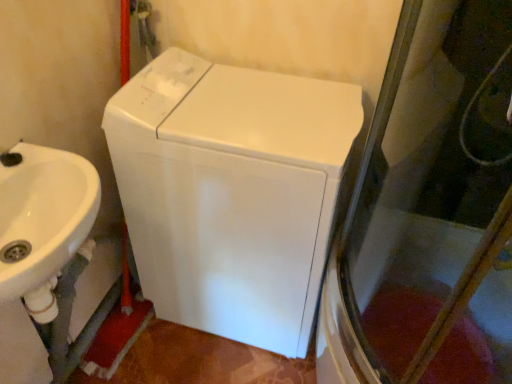
You are a GUI agent. You are given a task and a screenshot of the screen. Output one action in this format:
    pyautogui.click(x=<x>, y=<y>)
    Task: Click on the white glossy washing machine at center
    This screenshot has height=384, width=512.
    Given the screenshot: What is the action you would take?
    pyautogui.click(x=231, y=192)

What do you see at coordinates (231, 192) in the screenshot? The image size is (512, 384). I see `white glossy washing machine at center` at bounding box center [231, 192].

In order to face white glossy washing machine at center, should I rotate leftwards or rightwards?

A 1.339 degree turn to the left will do.

Measure the distance between white glossy washing machine at center and camera.

The distance of white glossy washing machine at center from camera is 37.16 inches.

Locate an element on the screen. white glossy sink at left is located at coordinates (42, 225).

Describe the element at coordinates (42, 225) in the screenshot. I see `white glossy sink at left` at that location.

Locate an element on the screen. This screenshot has height=384, width=512. white glossy washing machine at center is located at coordinates (231, 192).

Which is more to the left, white glossy washing machine at center or white glossy sink at left?

white glossy sink at left is more to the left.

Is white glossy washing machine at center positioned before white glossy sink at left?

That is False.

Considering the positions of points (176, 95) and (17, 188), is point (176, 95) closer to camera compared to point (17, 188)?

No, (176, 95) is further to viewer.

From the image's perspective, is white glossy washing machine at center below white glossy sink at left?

No.

From a real-world perspective, between white glossy washing machine at center and white glossy sink at left, who is vertically higher?

In real-world perspective, white glossy sink at left is above.

Is white glossy washing machine at center thinner than white glossy sink at left?

No, white glossy washing machine at center is not thinner than white glossy sink at left.

Which of these two, white glossy washing machine at center or white glossy sink at left, stands shorter?

white glossy sink at left.

Does white glossy washing machine at center have a larger size compared to white glossy sink at left?

Correct, white glossy washing machine at center is larger in size than white glossy sink at left.

Is white glossy washing machine at center positioned beyond the bounds of white glossy sink at left?

That's correct, white glossy washing machine at center is outside of white glossy sink at left.

Is white glossy washing machine at center far from white glossy sink at left?

No, white glossy washing machine at center is not far away from white glossy sink at left.

Could you tell me if white glossy washing machine at center is facing white glossy sink at left?

Yes, white glossy washing machine at center is oriented towards white glossy sink at left.

Can you tell me how much white glossy washing machine at center and white glossy sink at left differ in facing direction?

The angle between the facing direction of white glossy washing machine at center and the facing direction of white glossy sink at left is 90.2 degrees.

How far apart are white glossy washing machine at center and white glossy sink at left?

white glossy washing machine at center is 37.22 centimeters away from white glossy sink at left.

In the image, there is a white glossy washing machine at center. At what (x,y) coordinates should I click in order to perform the action: click on sink below it (from the image's perspective). Please return your answer as a coordinate pair (x, y). This screenshot has height=384, width=512. Looking at the image, I should click on (42, 225).

Is white glossy sink at left to the left of white glossy washing machine at center from the viewer's perspective?

Yes.

Which is in front, white glossy sink at left or white glossy washing machine at center?

white glossy sink at left is in front.

Is point (45, 297) positioned before point (234, 116)?

Yes.

From the image's perspective, is white glossy sink at left on white glossy washing machine at center?

No, from the image's perspective, white glossy sink at left is not above white glossy washing machine at center.

From a real-world perspective, which is physically below, white glossy sink at left or white glossy washing machine at center?

From a 3D spatial view, white glossy washing machine at center is below.

In terms of width, does white glossy sink at left look wider or thinner when compared to white glossy washing machine at center?

In the image, white glossy sink at left appears to be more narrow than white glossy washing machine at center.

Can you confirm if white glossy sink at left is taller than white glossy washing machine at center?

No, white glossy sink at left is not taller than white glossy washing machine at center.

Is white glossy sink at left bigger or smaller than white glossy washing machine at center?

In the image, white glossy sink at left appears to be smaller than white glossy washing machine at center.

Is white glossy sink at left spatially inside white glossy washing machine at center, or outside of it?

white glossy sink at left is outside white glossy washing machine at center.

Can you see white glossy sink at left touching white glossy washing machine at center?

No, white glossy sink at left is not touching white glossy washing machine at center.

Is white glossy sink at left looking in the opposite direction of white glossy washing machine at center?

white glossy sink at left does not have its back to white glossy washing machine at center.

I want to click on washing machine that appears behind the white glossy sink at left, so click(x=231, y=192).

Find the location of `sink to the left of white glossy washing machine at center`. sink to the left of white glossy washing machine at center is located at coordinates (42, 225).

Image resolution: width=512 pixels, height=384 pixels. I want to click on sink located in front of the white glossy washing machine at center, so [42, 225].